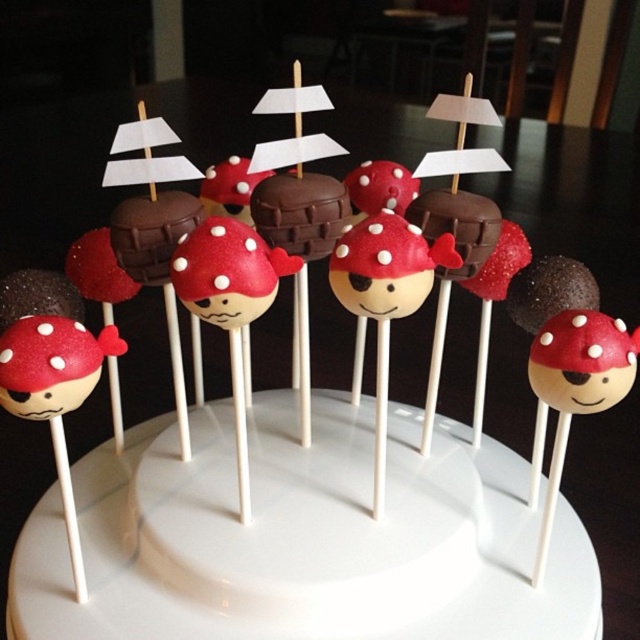
Between matte chocolate cake pop at center and chocolate matte at center, which one appears on the right side from the viewer's perspective?

From the viewer's perspective, matte chocolate cake pop at center appears more on the right side.

Is matte chocolate cake pop at center positioned at the back of chocolate matte at center?

No, it is not.

Locate an element on the screen. matte chocolate cake pop at center is located at coordinates point(577,387).

Measure the distance between matte chocolate cake pop at center and chocolate matte cake pop at center.

They are 10.76 inches apart.

Can you confirm if matte chocolate cake pop at center is bigger than chocolate matte cake pop at center?

Yes.

Which is in front, point (579, 348) or point (284, 244)?

Point (579, 348)

Image resolution: width=640 pixels, height=640 pixels. In order to click on matte chocolate cake pop at center in this screenshot , I will do 577,387.

Between chocolate matte cake pop at center and chocolate matte at center, which one is positioned higher?

chocolate matte cake pop at center

Which is behind, point (292, 176) or point (196, 214)?

The point (292, 176) is more distant.

This screenshot has height=640, width=640. I want to click on chocolate matte cake pop at center, so click(300, 212).

Locate an element on the screen. The width and height of the screenshot is (640, 640). chocolate matte cake pop at center is located at coordinates (300, 212).